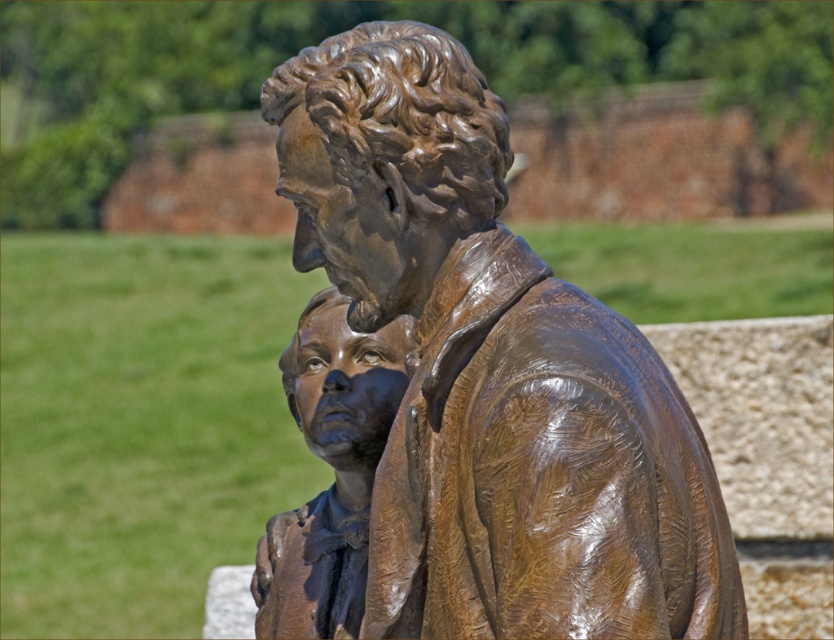
Does point (350, 112) come closer to viewer compared to point (307, 438)?

Yes, it is.

Does point (521, 627) come behind point (279, 531)?

No, it is not.

Where is `shiny bronze statue at center`? The image size is (834, 640). shiny bronze statue at center is located at coordinates (491, 371).

Where is `shiny bronze statue at center`? The height and width of the screenshot is (640, 834). shiny bronze statue at center is located at coordinates (491, 371).